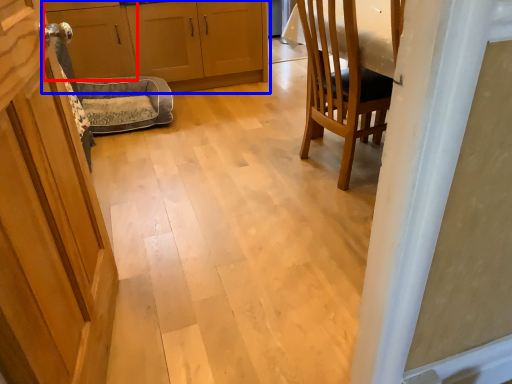
Question: Which object is closer to the camera taking this photo, cabinetry (highlighted by a red box) or cabinetry (highlighted by a blue box)?

Choices:
 (A) cabinetry
 (B) cabinetry

Answer: (A)